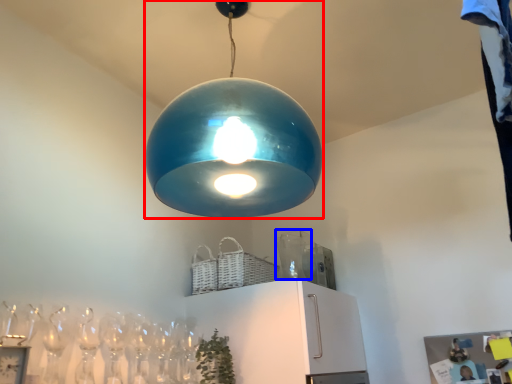
Question: Among these objects, which one is nearest to the camera, lamp (highlighted by a red box) or glass vase (highlighted by a blue box)?

Choices:
 (A) lamp
 (B) glass vase

Answer: (A)